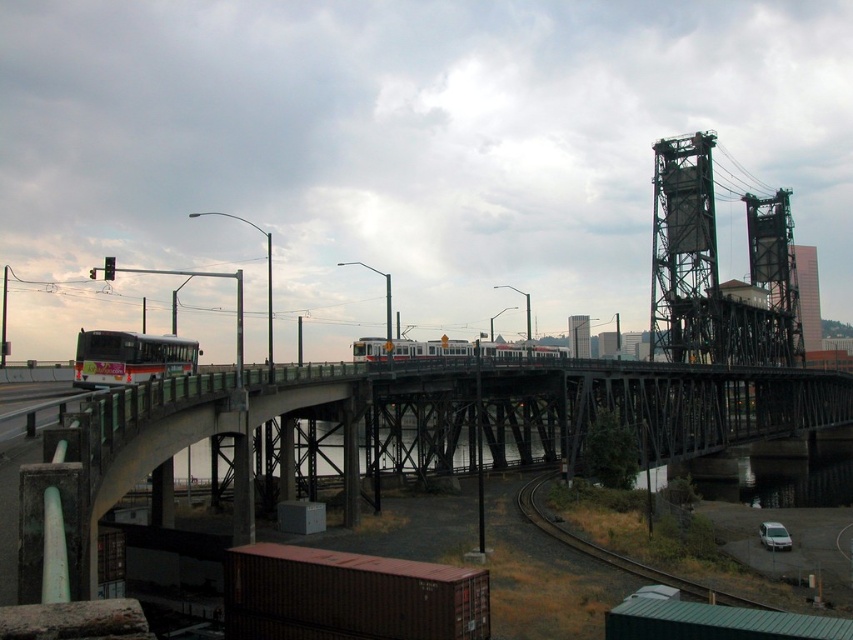
Question: Among these objects, which one is farthest from the camera?

Choices:
 (A) concrete bridge at center
 (B) white matte van at lower right
 (C) white matte bus at left

Answer: (B)

Question: Which object appears closest to the camera in this image?

Choices:
 (A) dark gray metal train track at lower right
 (B) concrete bridge at center
 (C) white matte van at lower right

Answer: (B)

Question: Is concrete bridge at center bigger than white matte van at lower right?

Choices:
 (A) yes
 (B) no

Answer: (A)

Question: Does concrete bridge at center come in front of white matte van at lower right?

Choices:
 (A) yes
 (B) no

Answer: (A)

Question: Does dark gray metal train track at lower right appear on the left side of white matte van at lower right?

Choices:
 (A) no
 (B) yes

Answer: (B)

Question: Which object appears farthest from the camera in this image?

Choices:
 (A) white matte van at lower right
 (B) white matte bus at left
 (C) dark gray metal train track at lower right
 (D) concrete bridge at center

Answer: (A)